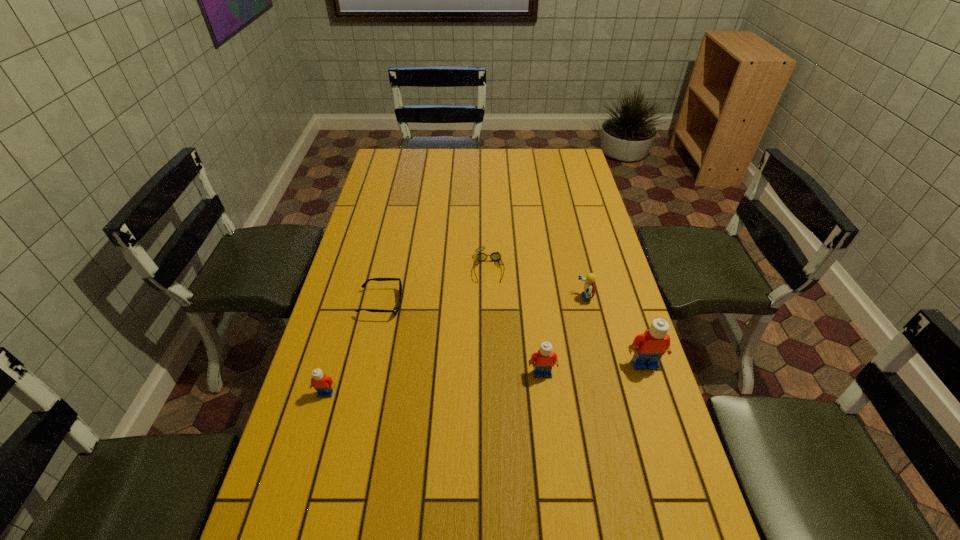
You are a GUI agent. You are given a task and a screenshot of the screen. Output one action in this format:
    pyautogui.click(x=<x>, y=<y>)
    Task: Click on the sunglasses
    
    Given the screenshot: What is the action you would take?
    pyautogui.click(x=396, y=309)

The height and width of the screenshot is (540, 960). Identify the location of free space located 0.310m on the face of the nearest object. (286, 532).

I want to click on vacant space located 0.250m on the face of the fourth object from left to right, so click(554, 474).

The width and height of the screenshot is (960, 540). I want to click on vacant space located 0.140m on the face of the rightmost Lego, so click(x=661, y=418).

The width and height of the screenshot is (960, 540). Identify the location of vacant space located on the front-facing side of the farthest object. (490, 306).

Locate an element on the screen. The height and width of the screenshot is (540, 960). vacant space situated on the front-facing side of the fifth object from left to right is located at coordinates (492, 298).

You are a GUI agent. You are given a task and a screenshot of the screen. Output one action in this format:
    pyautogui.click(x=<x>, y=<y>)
    Task: Click on the free space located on the front-facing side of the fifth object from left to right
    
    Given the screenshot: What is the action you would take?
    pyautogui.click(x=509, y=298)

This screenshot has height=540, width=960. I want to click on vacant space located on the front-facing side of the fifth object from left to right, so click(454, 298).

This screenshot has height=540, width=960. Identify the location of vacant region located 0.310m on the front-facing side of the sunglasses. (504, 303).

The height and width of the screenshot is (540, 960). Identify the location of Lego that is at the left edge. (323, 384).